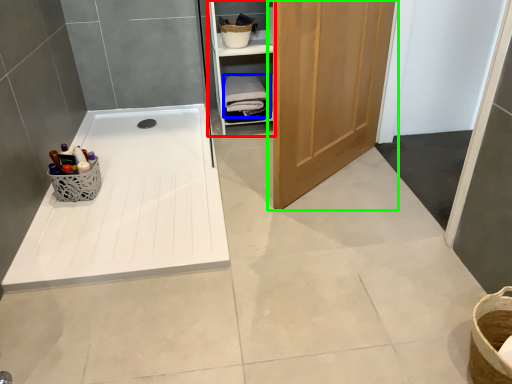
Question: Estimate the real-world distances between objects in this image. Which object is farther from cabinetry (highlighted by a red box), bath towel (highlighted by a blue box) or door (highlighted by a green box)?

Choices:
 (A) bath towel
 (B) door

Answer: (B)